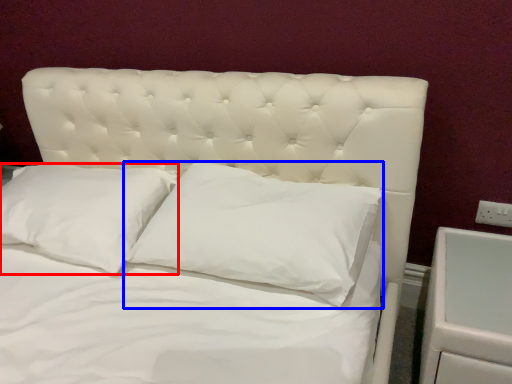
Question: Which of the following is the closest to the observer, pillow (highlighted by a red box) or pillow (highlighted by a blue box)?

Choices:
 (A) pillow
 (B) pillow

Answer: (B)